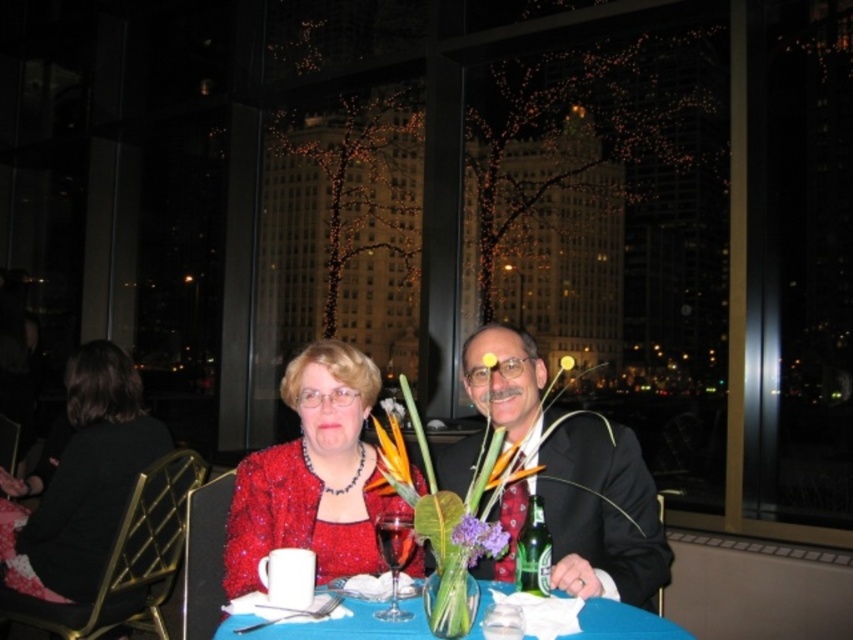
Question: Which of the following is the closest to the observer?

Choices:
 (A) pyautogui.click(x=500, y=556)
 (B) pyautogui.click(x=409, y=516)
 (C) pyautogui.click(x=53, y=522)

Answer: (A)

Question: Is transparent glass wine glass at center to the left of purple matte flower at center from the viewer's perspective?

Choices:
 (A) no
 (B) yes

Answer: (B)

Question: Estimate the real-world distances between objects in this image. Which object is closer to the shiny black suit at center?

Choices:
 (A) green leafy stem at center
 (B) blue fabric table at center

Answer: (B)

Question: Which object is the farthest from the matte black dress at left?

Choices:
 (A) transparent glass wine glass at center
 (B) shiny red dress at center
 (C) blue fabric table at center

Answer: (A)

Question: Is purple matte flower at center positioned at the back of green leafy stem at center?

Choices:
 (A) no
 (B) yes

Answer: (A)

Question: Observing the image, what is the correct spatial positioning of blue fabric table at center in reference to green leafy stem at center?

Choices:
 (A) below
 (B) above

Answer: (A)